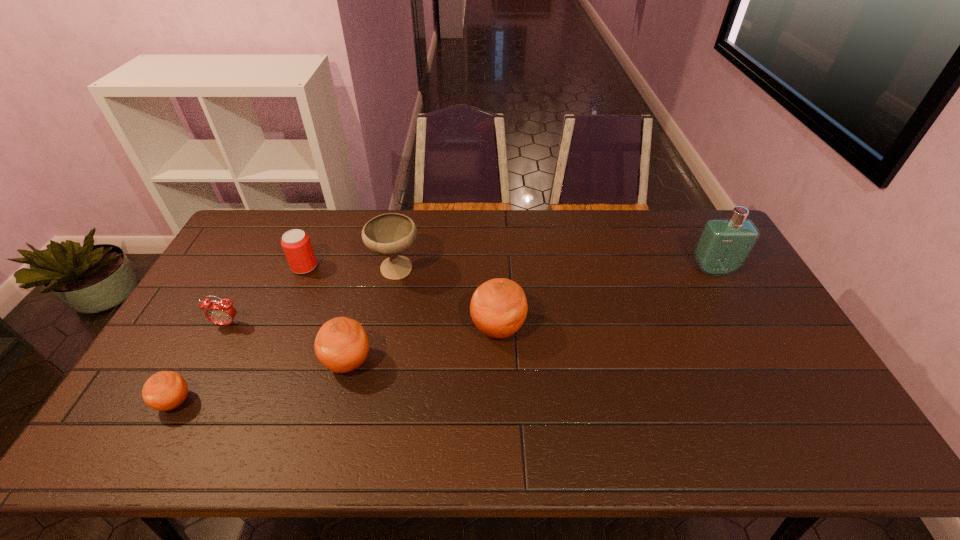
Considering the uniform spacing of oranges, where should an additional orange be positioned on the right? Please locate a free spot. Please provide its 2D coordinates. Your answer should be formatted as a tuple, i.e. [(x, y)], where the tuple contains the x and y coordinates of a point satisfying the conditions above.

[(629, 298)]